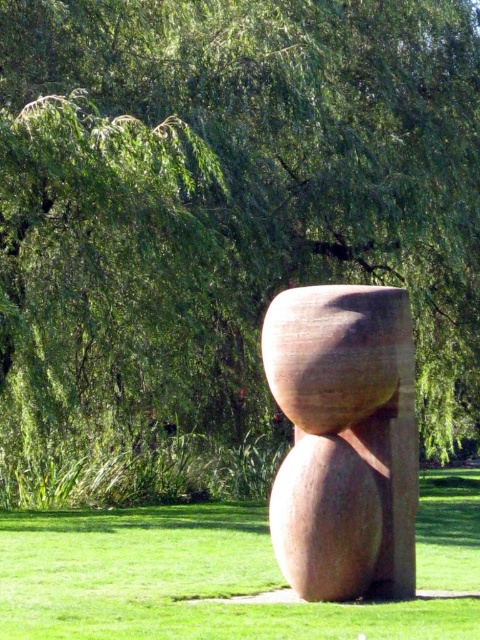
You are standing at the base of the large sculpture and want to walk to the green grass at lower center marked by point (x=179, y=580). Is there any part of the sculpture blocking your path?

The point (x=179, y=580) marks green grass at lower center, so there is no part of the sculpture blocking your path to it.

You are standing on the green grass at lower center and want to reach the matte brown stone sculpture at center. Which direction should you move to get closer to the sculpture?

You should move upward from the green grass at lower center to reach the matte brown stone sculpture at center because the sculpture is positioned above the grass.